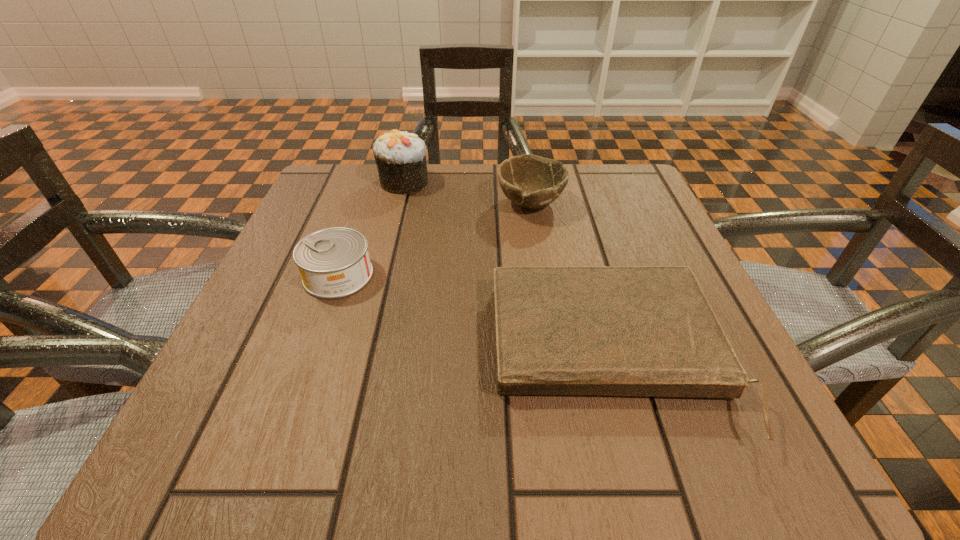
The width and height of the screenshot is (960, 540). Identify the location of free point at the far right corner. (631, 172).

Locate an element on the screen. The image size is (960, 540). vacant area that lies between the bowl and the third tallest object is located at coordinates (435, 240).

The image size is (960, 540). In order to click on free space between the second tallest object and the second shortest object in this screenshot , I will do `click(435, 240)`.

You are a GUI agent. You are given a task and a screenshot of the screen. Output one action in this format:
    pyautogui.click(x=<x>, y=<y>)
    Task: Click on the vacant area between the cupcake and the can
    
    Given the screenshot: What is the action you would take?
    pyautogui.click(x=371, y=228)

Identify the location of vacant region between the second shortest object and the cupcake. The image size is (960, 540). (371, 228).

The image size is (960, 540). Find the location of `vacant region between the bowl and the cupcake`. vacant region between the bowl and the cupcake is located at coordinates (468, 193).

In order to click on vacant space that is in between the second shortest object and the bowl in this screenshot , I will do `click(435, 240)`.

You are a GUI agent. You are given a task and a screenshot of the screen. Output one action in this format:
    pyautogui.click(x=<x>, y=<y>)
    Task: Click on the second closest object to the paperback book
    
    Given the screenshot: What is the action you would take?
    (x=334, y=262)

Select which object appears as the second closest to the shortest object. Please provide its 2D coordinates. Your answer should be formatted as a tuple, i.e. [(x, y)], where the tuple contains the x and y coordinates of a point satisfying the conditions above.

[(334, 262)]

The image size is (960, 540). In order to click on vacant region that satisfies the following two spatial constraints: 1. on the back side of the bowl; 2. on the right side of the third tallest object in this screenshot , I will do click(x=364, y=204).